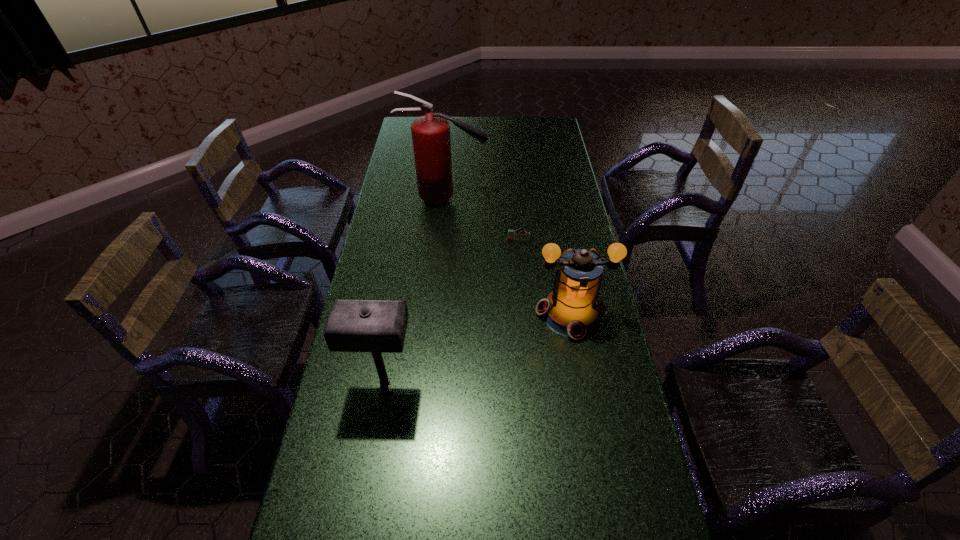
The height and width of the screenshot is (540, 960). In order to click on vacant point located on the front-facing side of the second nearest object in this screenshot , I will do `click(597, 458)`.

I want to click on blank space located on the handle side of the shortest object, so click(463, 240).

You are a GUI agent. You are given a task and a screenshot of the screen. Output one action in this format:
    pyautogui.click(x=<x>, y=<y>)
    Task: Click on the vacant region located 0.350m on the handle side of the shortest object
    The image size is (960, 540).
    Given the screenshot: What is the action you would take?
    pyautogui.click(x=415, y=240)

Find the location of `vacant space located 0.300m on the handle side of the shortest object`. vacant space located 0.300m on the handle side of the shortest object is located at coordinates click(x=428, y=240).

You are a GUI agent. You are given a task and a screenshot of the screen. Output one action in this format:
    pyautogui.click(x=<x>, y=<y>)
    Task: Click on the fire extinguisher positioned at the left edge
    
    Given the screenshot: What is the action you would take?
    pyautogui.click(x=431, y=141)

At what (x,y) coordinates should I click in order to perform the action: click on mallet at the left edge. Please return your answer as a coordinate pair (x, y). This screenshot has width=960, height=540. Looking at the image, I should click on [378, 326].

Locate an element on the screen. The image size is (960, 540). object that is at the right edge is located at coordinates (573, 308).

The width and height of the screenshot is (960, 540). In the image, there is a desktop. Find the location of `vacant region at the far edge`. vacant region at the far edge is located at coordinates (487, 126).

At what (x,y) coordinates should I click in order to perform the action: click on free space at the left edge of the desktop. Please return your answer as a coordinate pair (x, y). Looking at the image, I should click on (x=412, y=178).

Identify the location of free space at the right edge of the desktop. Image resolution: width=960 pixels, height=540 pixels. (540, 141).